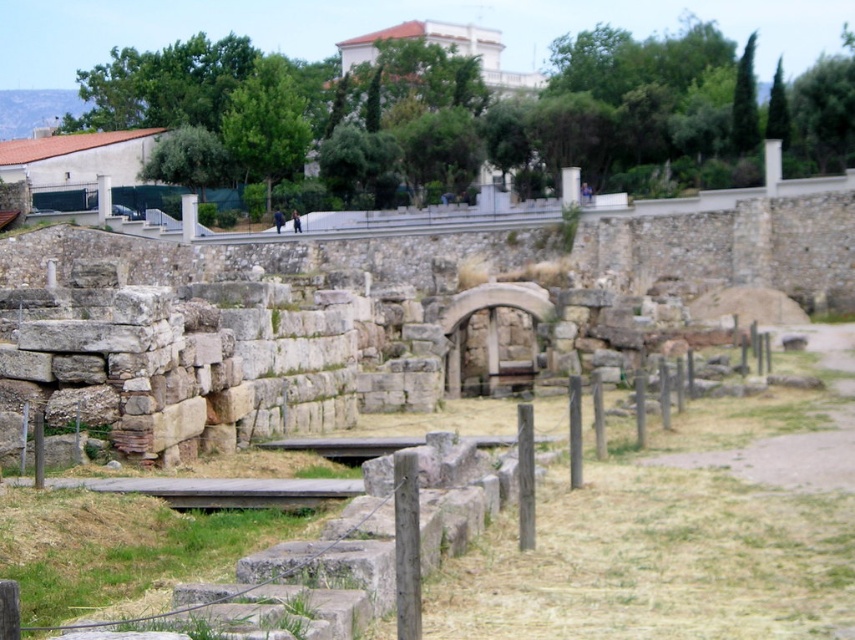
Question: Which point appears closest to the camera in this image?

Choices:
 (A) (187, 241)
 (B) (104, 186)

Answer: (A)

Question: Which point appears closest to the camera in this image?

Choices:
 (A) (186, 195)
 (B) (108, 198)

Answer: (B)

Question: Can you confirm if white stone pillar at center is smaller than smooth stone pillar at center?

Choices:
 (A) no
 (B) yes

Answer: (A)

Question: Which point is closer to the camera?

Choices:
 (A) (109, 200)
 (B) (195, 202)

Answer: (B)

Question: Can you confirm if white stone pillar at center is positioned above smooth stone pillar at center?

Choices:
 (A) yes
 (B) no

Answer: (B)

Question: Is white stone pillar at center in front of smooth stone pillar at center?

Choices:
 (A) no
 (B) yes

Answer: (B)